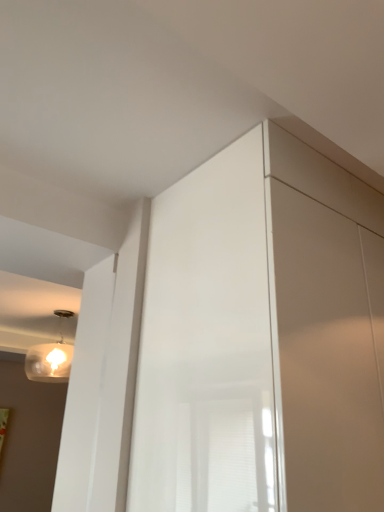
Question: Which is correct: matte glass lamp at upper left is inside glossy white screen door at center, or outside of it?

Choices:
 (A) inside
 (B) outside

Answer: (B)

Question: In the image, is matte glass lamp at upper left positioned in front of or behind glossy white screen door at center?

Choices:
 (A) front
 (B) behind

Answer: (B)

Question: Is matte glass lamp at upper left to the left or to the right of glossy white screen door at center in the image?

Choices:
 (A) left
 (B) right

Answer: (A)

Question: Which is correct: glossy white screen door at center is inside matte glass lamp at upper left, or outside of it?

Choices:
 (A) inside
 (B) outside

Answer: (B)

Question: Is glossy white screen door at center wider or thinner than matte glass lamp at upper left?

Choices:
 (A) thin
 (B) wide

Answer: (B)

Question: In terms of size, does glossy white screen door at center appear bigger or smaller than matte glass lamp at upper left?

Choices:
 (A) small
 (B) big

Answer: (B)

Question: Is glossy white screen door at center taller or shorter than matte glass lamp at upper left?

Choices:
 (A) short
 (B) tall

Answer: (B)